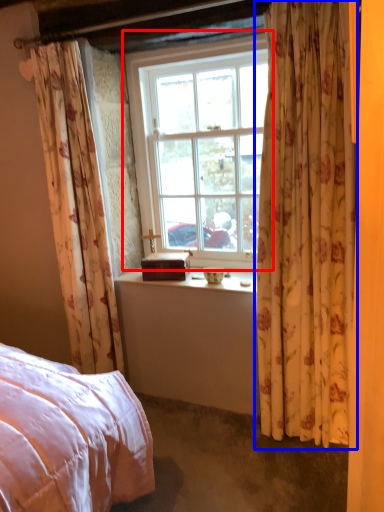
Question: Which object appears closest to the camera in this image, window (highlighted by a red box) or curtain (highlighted by a blue box)?

Choices:
 (A) window
 (B) curtain

Answer: (B)